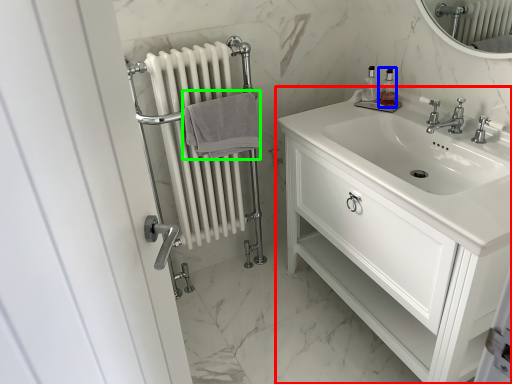
Question: Which is nearer to the bathroom cabinet (highlighted by a red box)? soap dispenser (highlighted by a blue box) or bath towel (highlighted by a green box).

Choices:
 (A) soap dispenser
 (B) bath towel

Answer: (B)